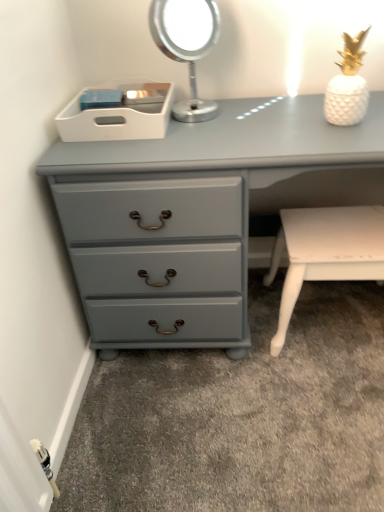
Find the location of a particular element. Image resolution: width=384 pixels, height=512 pixels. vacant region in front of matte gray chest of drawers at lower left is located at coordinates (251, 428).